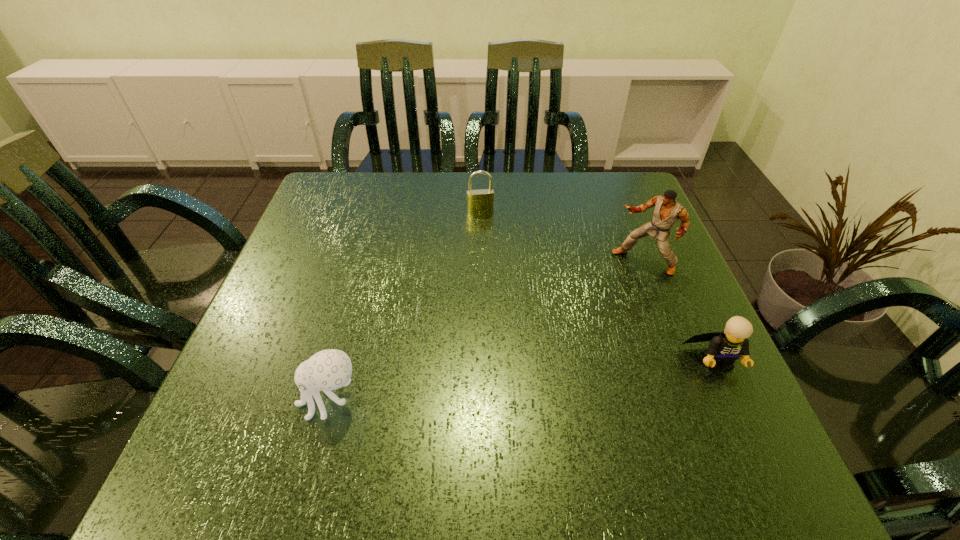
Where is `object that is positioned at the near left corner`? object that is positioned at the near left corner is located at coordinates (331, 369).

Find the location of a particular element. free space at the far edge is located at coordinates (540, 174).

This screenshot has height=540, width=960. Identify the location of vacant area at the near edge. (537, 385).

In the image, there is a desktop. What are the coordinates of `free space at the left edge` in the screenshot? It's located at (286, 338).

In the image, there is a desktop. At what (x,y) coordinates should I click in order to perform the action: click on vacant space at the right edge. Please return your answer as a coordinate pair (x, y). Looking at the image, I should click on (657, 313).

Identify the location of vacant space at the far left corner of the desktop. (372, 182).

Locate an element on the screen. vacant area at the far right corner is located at coordinates (597, 209).

At what (x,y) coordinates should I click in order to perform the action: click on free space at the near right corner of the desktop. Please return your answer as a coordinate pair (x, y). Looking at the image, I should click on (741, 423).

The height and width of the screenshot is (540, 960). I want to click on free space between the second farthest object and the Lego, so click(680, 312).

The height and width of the screenshot is (540, 960). I want to click on free space between the third object from right to left and the tallest object, so click(562, 237).